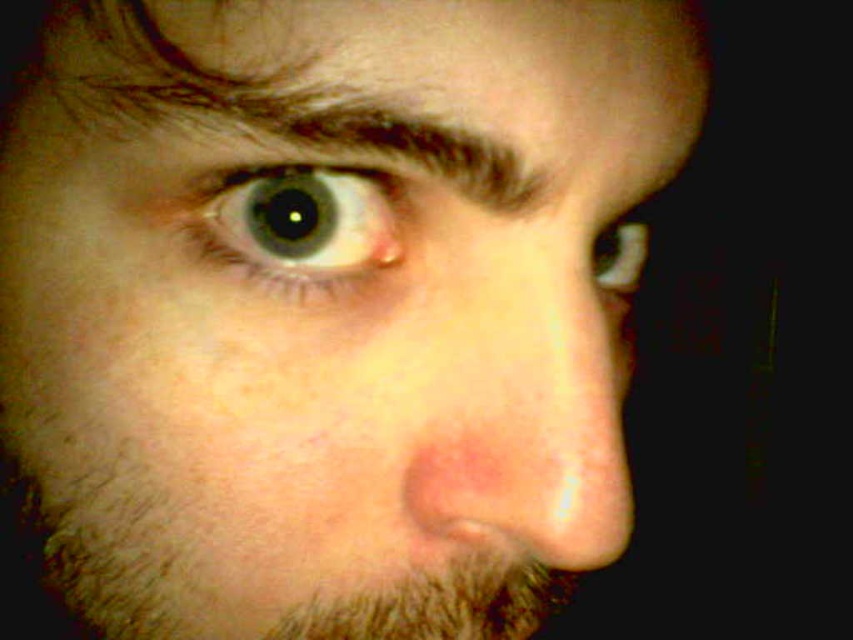
Is brown hair at upper left positioned before brown fuzzy beard at lower left?

Yes, it is in front of brown fuzzy beard at lower left.

Is brown hair at upper left smaller than brown fuzzy beard at lower left?

Indeed, brown hair at upper left has a smaller size compared to brown fuzzy beard at lower left.

I want to click on brown hair at upper left, so click(x=254, y=96).

Is point (488, 168) positioned after point (619, 248)?

No, it is in front of (619, 248).

Is point (56, 6) positioned in front of point (628, 244)?

Yes, point (56, 6) is closer to viewer.

Is point (352, 97) closer to viewer compared to point (624, 253)?

Yes, it is.

Find the location of a particular element. The width and height of the screenshot is (853, 640). brown hair at upper left is located at coordinates (254, 96).

Between point (109, 637) and point (641, 246), which one is positioned behind?

The point (641, 246) is behind.

Is brown fuzzy beard at lower left wider than matte white eye at upper right?

Yes.

Is point (126, 605) farther from camera compared to point (595, 272)?

No.

Find the location of a particular element. The image size is (853, 640). brown fuzzy beard at lower left is located at coordinates (91, 554).